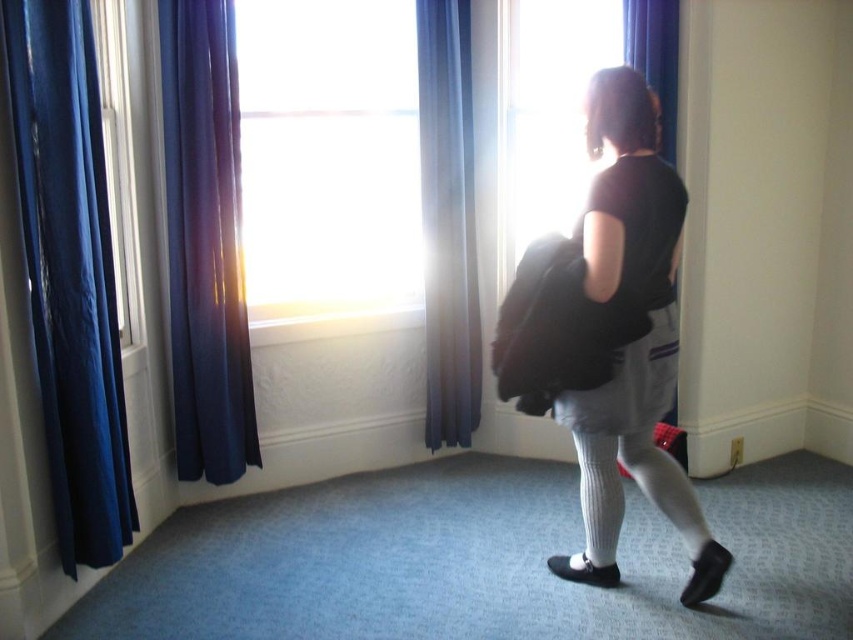
You are a painter standing 2.5 meters away from the blue fabric curtain at center. Can you reach the curtain with a 1.5 meter long pole?

The distance between you and the blue fabric curtain at center is 3.18 meters. Since your pole is only 1.5 meters long, you cannot reach the curtain with it.

You are a decorator trying to balance the room. You have two curtains, the dark blue fabric curtain at left and the blue fabric curtain at center. Which curtain should you adjust to make them take up equal space?

The dark blue fabric curtain at left occupies less space than the blue fabric curtain at center, so you should adjust the dark blue fabric curtain at left to take up more space to match the blue fabric curtain at center.

You are a stage designer preparing for a play. You need to place a 1.5 meter wide decorative panel between the blue glossy curtain at left and the blue fabric curtain at center. Based on the scene, will the panel fit between them?

The blue glossy curtain at left and blue fabric curtain at center are 1.42 meters apart. Since the panel is 1.5 meters wide, it will not fit between them as the distance is shorter than the panel.